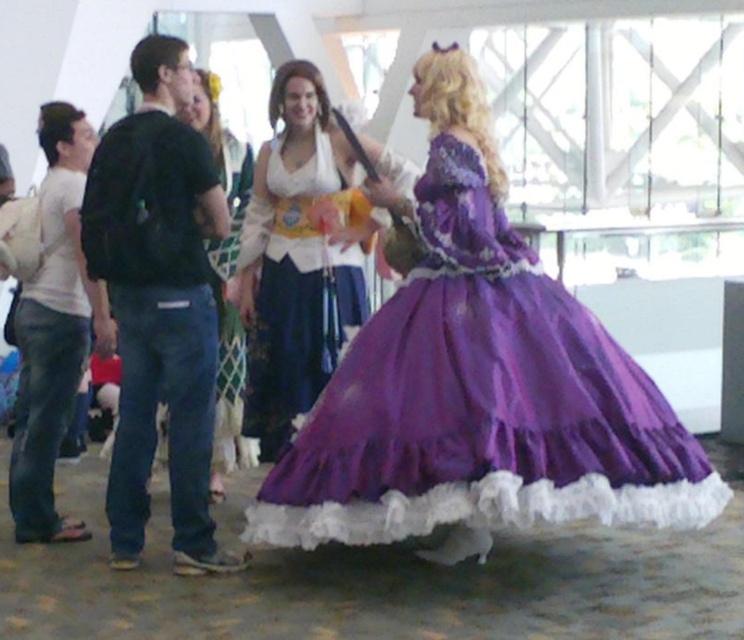
Who is lower down, purple satin dress at center or black cotton shirt at left?

purple satin dress at center is below.

Between point (356, 380) and point (124, 170), which one is positioned in front?

Point (124, 170)

Does point (513, 301) lie in front of point (170, 426)?

Yes, point (513, 301) is closer to viewer.

Identify the location of purple satin dress at center. (481, 401).

Is point (1, 209) positioned after point (248, 458)?

No, it is in front of (248, 458).

Between point (96, 346) and point (237, 342), which one is positioned in front?

Positioned in front is point (96, 346).

The height and width of the screenshot is (640, 744). I want to click on matte white shirt at left, so click(51, 320).

Can you confirm if purple satin dress at center is positioned to the left of matte white shirt at left?

In fact, purple satin dress at center is to the right of matte white shirt at left.

You are a GUI agent. You are given a task and a screenshot of the screen. Output one action in this format:
    pyautogui.click(x=<x>, y=<y>)
    Task: Click on the purple satin dress at center
    The height and width of the screenshot is (640, 744).
    Given the screenshot: What is the action you would take?
    pyautogui.click(x=481, y=401)